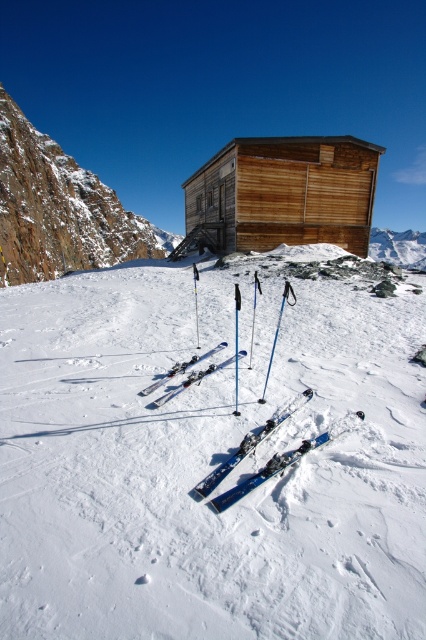
Locate an element on the screen. This screenshot has height=640, width=426. rugged stone mountain at upper left is located at coordinates (60, 209).

Does shiny blue skis at center appear over shiny black skis at center?

No.

The height and width of the screenshot is (640, 426). I want to click on shiny blue skis at center, so click(x=270, y=468).

The width and height of the screenshot is (426, 640). I want to click on shiny blue skis at center, so click(x=270, y=468).

The height and width of the screenshot is (640, 426). Identify the location of shiny black skis at center. (181, 369).

Can you confirm if shiny black skis at center is thinner than blue glossy ski pole at center?

No.

Who is more distant from viewer, (196, 356) or (236, 344)?

Point (236, 344)

Where is `shiny black skis at center`? shiny black skis at center is located at coordinates point(181,369).